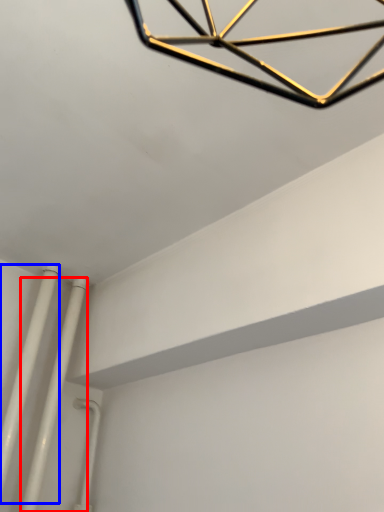
Question: Which object is further to the camera taking this photo, pipe (highlighted by a red box) or pipe (highlighted by a blue box)?

Choices:
 (A) pipe
 (B) pipe

Answer: (A)